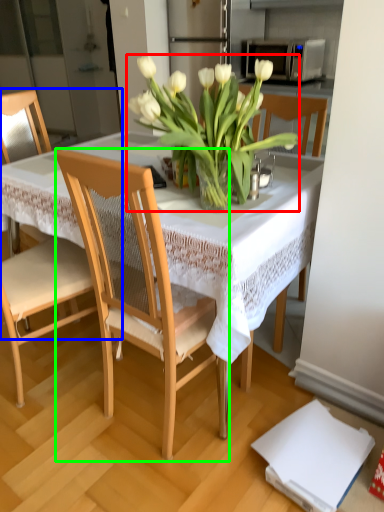
Question: Which is nearer to the flower (highlighted by a red box)? chair (highlighted by a blue box) or chair (highlighted by a green box).

Choices:
 (A) chair
 (B) chair

Answer: (B)